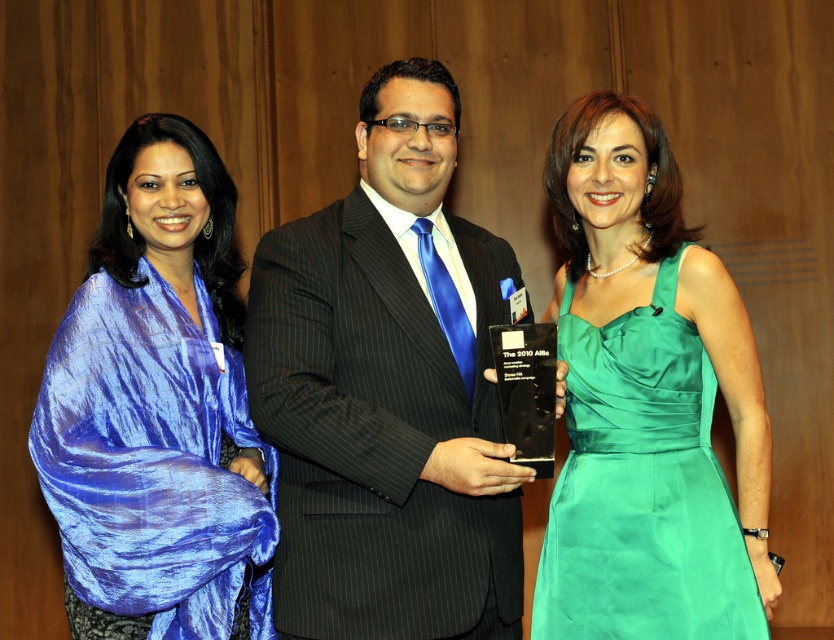
Question: Can you confirm if matte black suit at center is positioned above emerald satin dress at center?

Choices:
 (A) no
 (B) yes

Answer: (B)

Question: Which of the following is the closest to the observer?

Choices:
 (A) emerald satin dress at center
 (B) blue silk scarf at left
 (C) matte black suit at center

Answer: (C)

Question: Which point is closer to the camera?

Choices:
 (A) (410, 618)
 (B) (244, 308)

Answer: (A)

Question: Which object is positioned closest to the emerald satin dress at center?

Choices:
 (A) blue silk scarf at left
 (B) matte black suit at center

Answer: (B)

Question: From the image, what is the correct spatial relationship of matte black suit at center in relation to emerald satin dress at center?

Choices:
 (A) above
 (B) below

Answer: (A)

Question: Can you confirm if matte black suit at center is smaller than blue silk scarf at left?

Choices:
 (A) no
 (B) yes

Answer: (A)